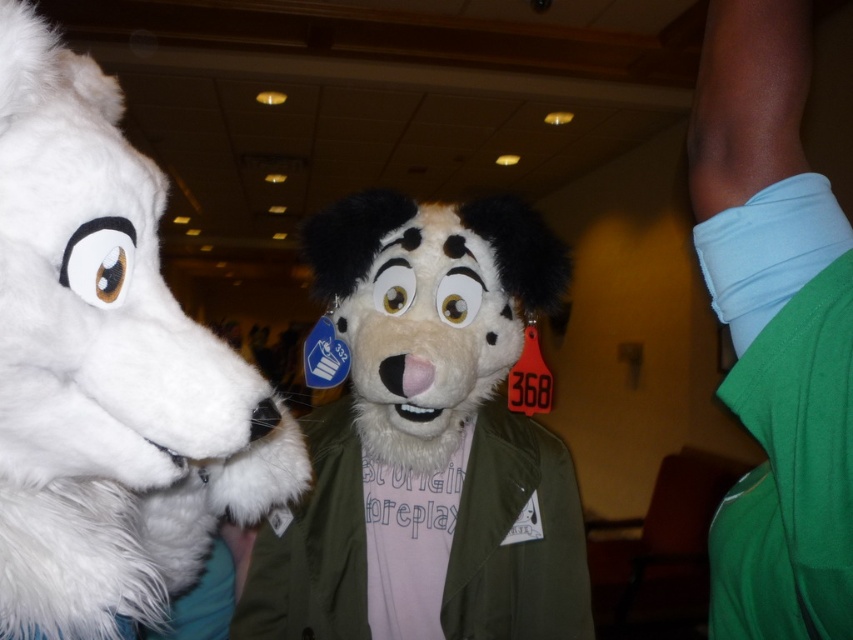
Who is positioned more to the left, white furry head at left or fuzzy tan dog at center?

Positioned to the left is white furry head at left.

Between point (4, 40) and point (519, 300), which one is positioned in front?

Positioned in front is point (4, 40).

Identify the location of white furry head at left. (109, 376).

Image resolution: width=853 pixels, height=640 pixels. Describe the element at coordinates (109, 376) in the screenshot. I see `white furry head at left` at that location.

Describe the element at coordinates (109, 376) in the screenshot. The height and width of the screenshot is (640, 853). I see `white furry head at left` at that location.

Find the location of `white furry head at left`. white furry head at left is located at coordinates (109, 376).

How much distance is there between fuzzy tan dog at center and green fabric shirt at right?

They are 16.30 inches apart.

Can you confirm if fuzzy tan dog at center is thinner than green fabric shirt at right?

No, fuzzy tan dog at center is not thinner than green fabric shirt at right.

Between point (544, 506) and point (711, 253), which one is positioned behind?

Point (544, 506)

Image resolution: width=853 pixels, height=640 pixels. In order to click on fuzzy tan dog at center in this screenshot , I will do `click(427, 440)`.